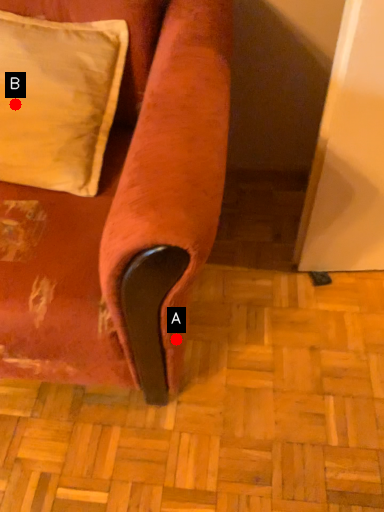
Question: Two points are circled on the image, labeled by A and B beside each circle. Which point is closer to the camera taking this photo?

Choices:
 (A) A is closer
 (B) B is closer

Answer: (A)